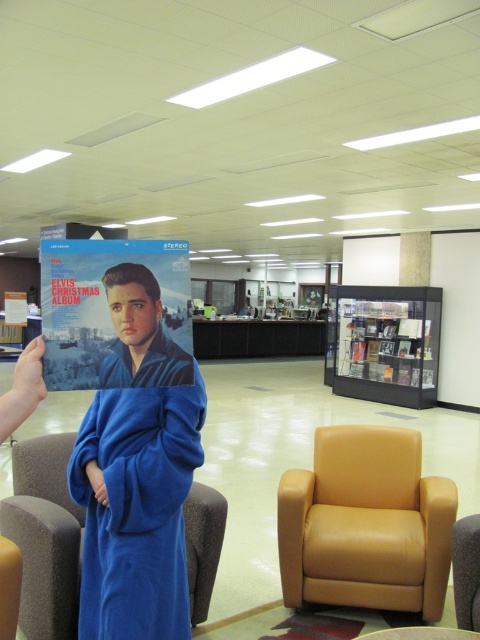
Question: Which object appears closest to the camera in this image?

Choices:
 (A) matte blue vinyl record at left
 (B) transparent glass bookshelf at center
 (C) blue fleece robe at center

Answer: (A)

Question: Is tan leather armchair at lower right bigger than matte blue vinyl record at left?

Choices:
 (A) no
 (B) yes

Answer: (B)

Question: Among these objects, which one is farthest from the camera?

Choices:
 (A) tan leather armchair at lower right
 (B) matte blue vinyl record at left

Answer: (A)

Question: Is blue fleece robe at center positioned at the back of tan leather armchair at lower right?

Choices:
 (A) yes
 (B) no

Answer: (B)

Question: Based on their relative distances, which object is nearer to the transparent glass bookshelf at center?

Choices:
 (A) blue fleece robe at center
 (B) matte blue vinyl record at left
 (C) tan leather armchair at lower right

Answer: (C)

Question: Is tan leather armchair at lower right wider than transparent glass bookshelf at center?

Choices:
 (A) yes
 (B) no

Answer: (B)